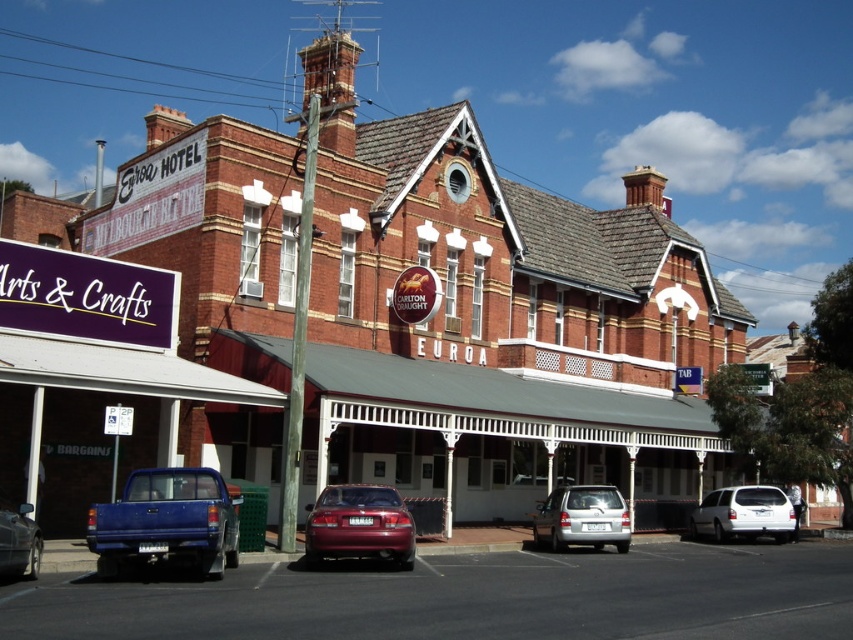
Question: Is silver metallic hatchback at center to the right of metallic blue pickup truck at lower left from the viewer's perspective?

Choices:
 (A) yes
 (B) no

Answer: (A)

Question: Which point is closer to the camera taking this photo?

Choices:
 (A) (167, 492)
 (B) (253, 477)

Answer: (A)

Question: Is blue metallic truck at lower left above metallic blue pickup truck at lower left?

Choices:
 (A) no
 (B) yes

Answer: (A)

Question: Which object is positioned farthest from the shiny red sedan at center?

Choices:
 (A) silver metallic hatchback at center
 (B) white painted wood awning at center
 (C) metallic blue pickup truck at lower left
 (D) blue metallic truck at lower left

Answer: (A)

Question: Which of the following is the closest to the observer?

Choices:
 (A) white painted wood awning at center
 (B) metallic blue pickup truck at lower left

Answer: (B)

Question: Does shiny red sedan at center appear over metallic blue pickup truck at lower left?

Choices:
 (A) yes
 (B) no

Answer: (B)